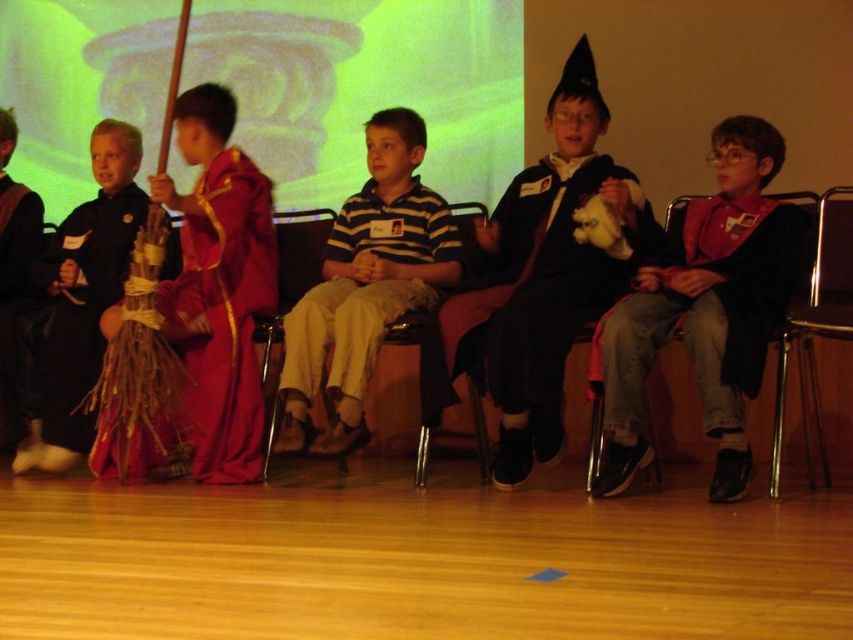
Question: Does black matte wizard hat at center appear over striped cotton shirt at center?

Choices:
 (A) no
 (B) yes

Answer: (B)

Question: Estimate the real-world distances between objects in this image. Which object is farther from the matte black jacket at right?

Choices:
 (A) striped cotton shirt at center
 (B) braided straw broom at left
 (C) black matte wizard hat at center
 (D) velvet maroon robe at left

Answer: (B)

Question: Which point is farther to the camera?

Choices:
 (A) velvet maroon robe at left
 (B) metallic silver chair at right
 (C) braided straw broom at left
 (D) striped cotton shirt at center

Answer: (C)

Question: Is striped cotton shirt at center thinner than braided straw broom at left?

Choices:
 (A) yes
 (B) no

Answer: (B)

Question: In this image, where is braided straw broom at left located relative to metallic silver chair at right?

Choices:
 (A) left
 (B) right

Answer: (A)

Question: Which object is closer to the camera taking this photo?

Choices:
 (A) black matte wizard hat at center
 (B) matte black jacket at right
 (C) metallic silver chair at right

Answer: (B)